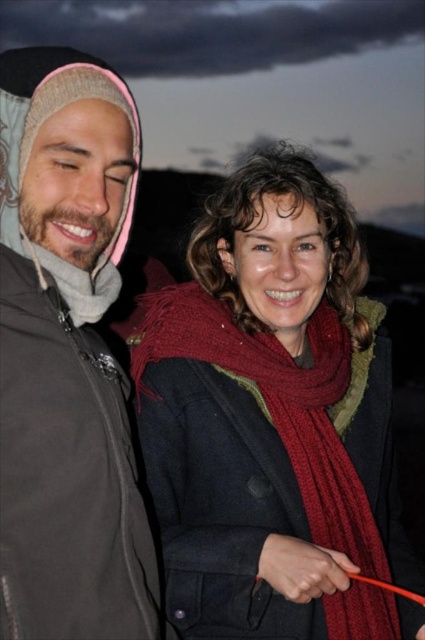
Question: Is matte gray jacket at left to the right of red knitted scarf at center from the viewer's perspective?

Choices:
 (A) yes
 (B) no

Answer: (B)

Question: Can you confirm if matte gray jacket at left is thinner than red knitted scarf at center?

Choices:
 (A) yes
 (B) no

Answer: (A)

Question: Does matte gray jacket at left appear on the left side of red knitted scarf at center?

Choices:
 (A) yes
 (B) no

Answer: (A)

Question: Which point is farther to the camera?

Choices:
 (A) matte gray jacket at left
 (B) red knitted scarf at center

Answer: (B)

Question: Which point is farther to the camera?

Choices:
 (A) matte gray jacket at left
 (B) red knitted scarf at center

Answer: (B)